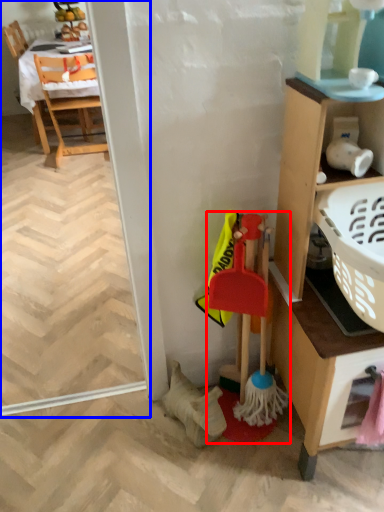
Question: Which object is closer to the camera taking this photo, toy (highlighted by a red box) or screen door (highlighted by a blue box)?

Choices:
 (A) toy
 (B) screen door

Answer: (A)